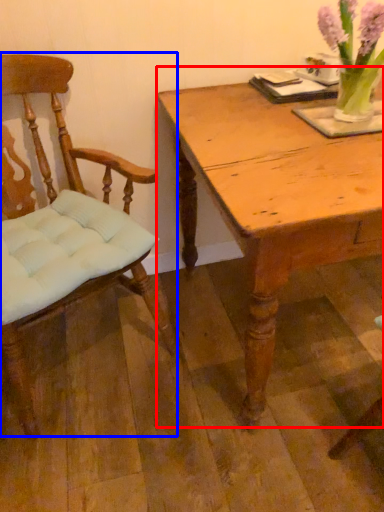
Question: Which of the following is the farthest to the observer, table (highlighted by a red box) or chair (highlighted by a blue box)?

Choices:
 (A) table
 (B) chair

Answer: (A)